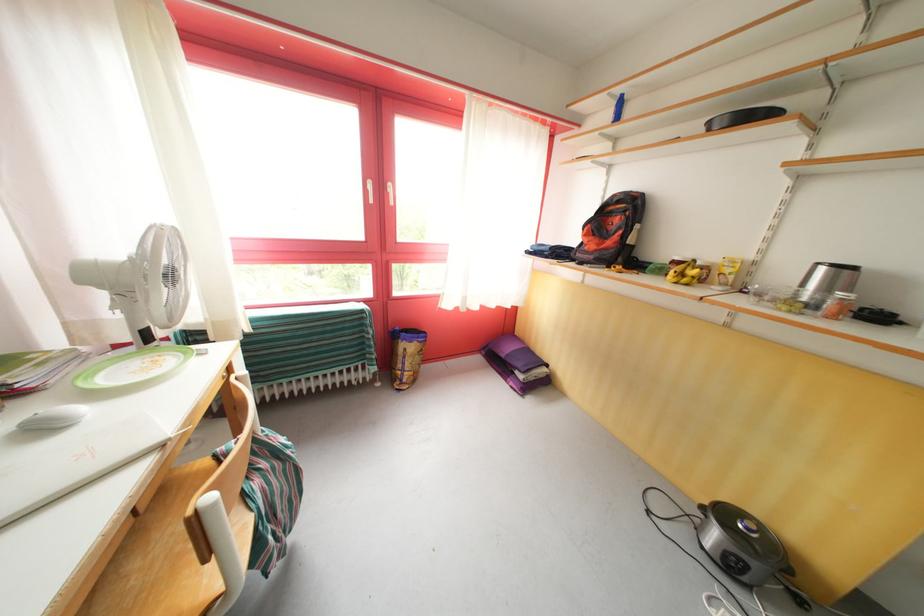
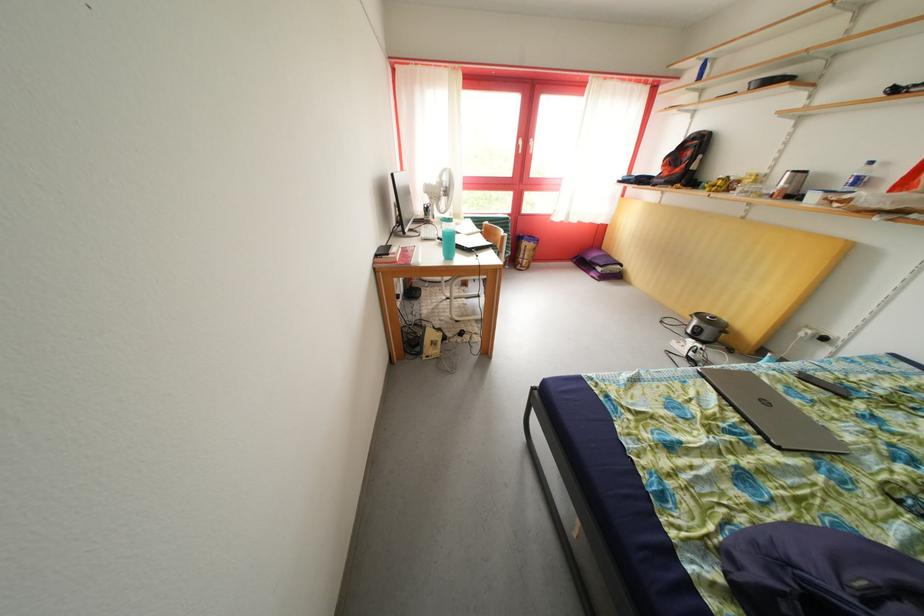
In the second image, find the point that corresponds to point 378,192 in the first image.

(528, 148)